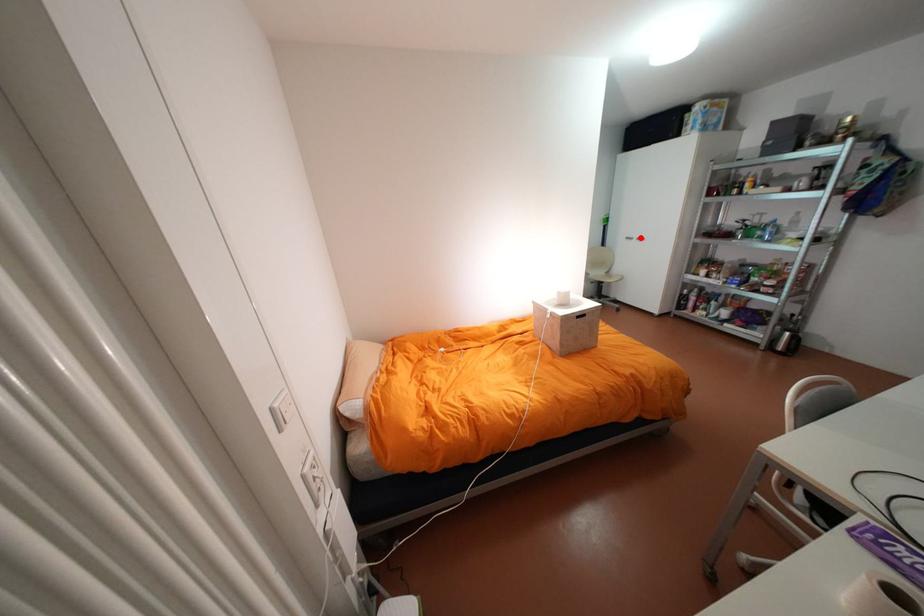
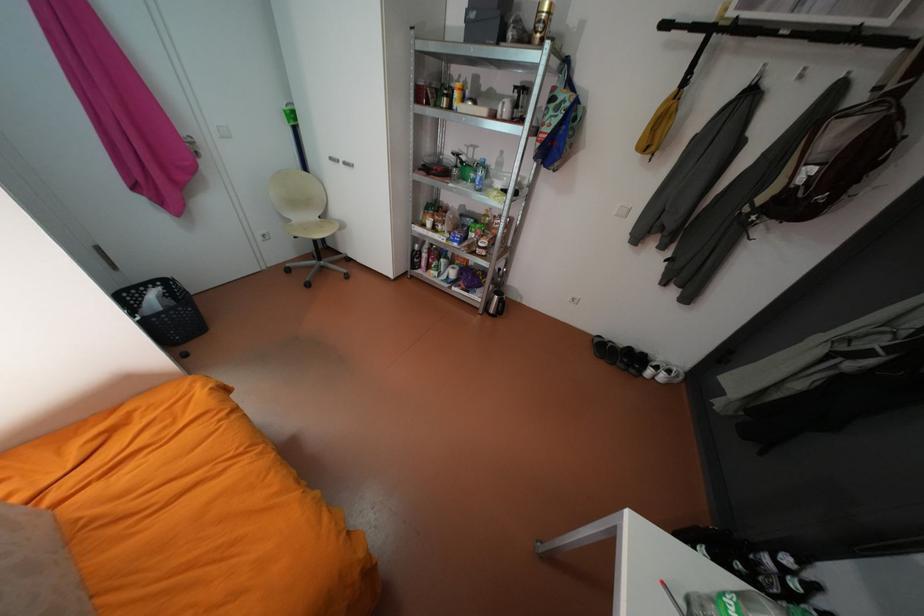
Question: A red point is marked in image1. In image2, is the corresponding 3D point closer to the camera or farther? Reply with the corresponding letter.

Choices:
 (A) The corresponding 3D point is closer.
 (B) The corresponding 3D point is farther.

Answer: (B)